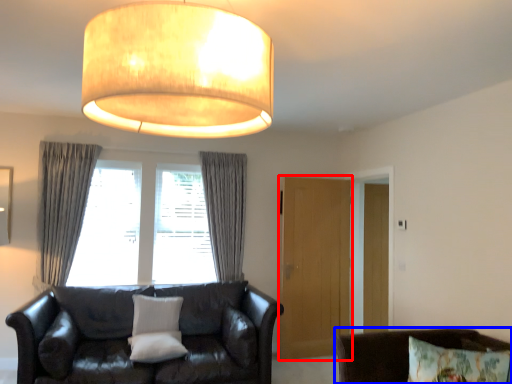
Question: Which point is further to the camera, glass door (highlighted by a red box) or chair (highlighted by a blue box)?

Choices:
 (A) glass door
 (B) chair

Answer: (A)